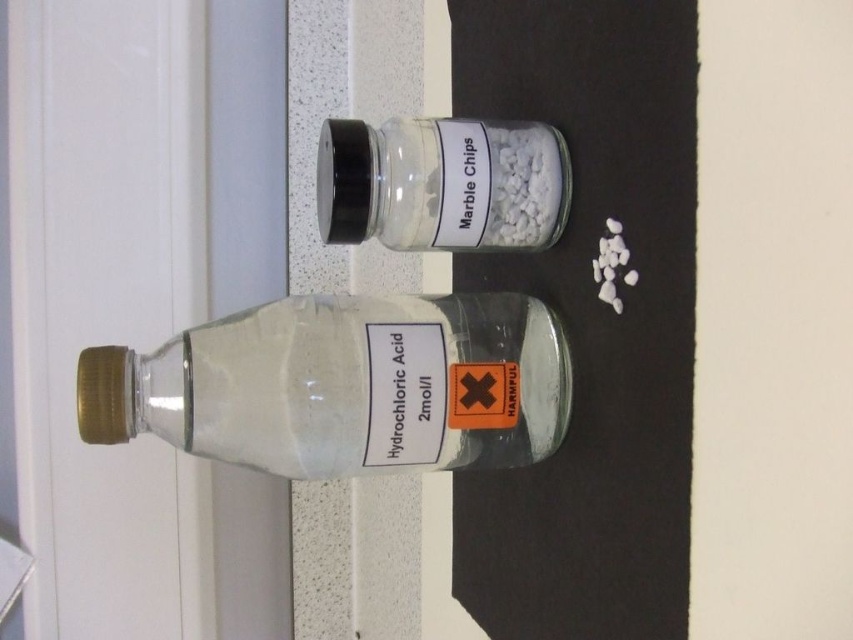
You are a lab assistant who needs to place the transparent glass bottle at center and the transparent glass jar of marble chips at center on a shelf. The shelf has a maximum width of 1 meter. According to the image, can both items fit side by side without overlapping?

The transparent glass bottle at center is to the left of the transparent glass jar of marble chips at center. Since their positions are side by side in the image and the shelf is 1 meter wide, they can fit without overlapping as long as their combined width doesn

You are a delivery robot that is 1.5 meters tall. You are in a lab and need to deliver a package through the transparent glass door at left. Can you pass through the door without bending?

The transparent glass door at left is 1.61 meters away from the viewer. Since the robot is 1.5 meters tall, it can pass through the transparent glass door at left without bending because the door height is sufficient.